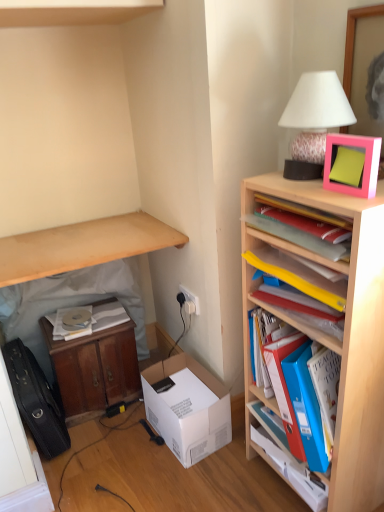
Question: Considering the relative positions of wooden bookshelf at right, acting as the second shelf starting from the bottom, and white paper at lower left, marked as the 2th book in a right-to-left arrangement, in the image provided, is wooden bookshelf at right, acting as the second shelf starting from the bottom, to the left of white paper at lower left, marked as the 2th book in a right-to-left arrangement, from the viewer's perspective?

Choices:
 (A) no
 (B) yes

Answer: (A)

Question: Is wooden bookshelf at right, placed as the 2th shelf when sorted from top to bottom, thinner than white paper at lower left, which ranks as the second book in front-to-back order?

Choices:
 (A) yes
 (B) no

Answer: (B)

Question: Is the depth of wooden bookshelf at right, placed as the 2th shelf when sorted from top to bottom, greater than that of white paper at lower left, marked as the 2th book in a right-to-left arrangement?

Choices:
 (A) yes
 (B) no

Answer: (B)

Question: Is wooden bookshelf at right, placed as the 2th shelf when sorted from top to bottom, positioned before white paper at lower left, the 1th book when ordered from left to right?

Choices:
 (A) no
 (B) yes

Answer: (B)

Question: Is wooden bookshelf at right, acting as the second shelf starting from the bottom, not within white paper at lower left, marked as the 2th book in a right-to-left arrangement?

Choices:
 (A) yes
 (B) no

Answer: (A)

Question: From a real-world perspective, is blue plastic folders at right, which appears as the 3th shelf when viewed from the top, above or below white paper at lower left, the 1th book when ordered from left to right?

Choices:
 (A) below
 (B) above

Answer: (B)

Question: From their relative heights in the image, would you say blue plastic folders at right, which ranks as the first shelf in bottom-to-top order, is taller or shorter than white paper at lower left, marked as the 2th book in a right-to-left arrangement?

Choices:
 (A) tall
 (B) short

Answer: (A)

Question: Considering the positions of point (314, 437) and point (51, 321), is point (314, 437) closer or farther from the camera than point (51, 321)?

Choices:
 (A) closer
 (B) farther

Answer: (A)

Question: Looking at their shapes, would you say blue plastic folders at right, which ranks as the first shelf in bottom-to-top order, is wider or thinner than white paper at lower left, which ranks as the second book in front-to-back order?

Choices:
 (A) wide
 (B) thin

Answer: (A)

Question: From the image's perspective, relative to pink matte picture frame at upper right, is white cardboard box at lower center above or below?

Choices:
 (A) above
 (B) below

Answer: (B)

Question: Visually, is white cardboard box at lower center positioned to the left or to the right of pink matte picture frame at upper right?

Choices:
 (A) left
 (B) right

Answer: (A)

Question: From their relative heights in the image, would you say white cardboard box at lower center is taller or shorter than pink matte picture frame at upper right?

Choices:
 (A) tall
 (B) short

Answer: (A)

Question: Would you say white cardboard box at lower center is inside or outside pink matte picture frame at upper right?

Choices:
 (A) outside
 (B) inside

Answer: (A)

Question: Does point (291, 272) appear closer or farther from the camera than point (67, 258)?

Choices:
 (A) closer
 (B) farther

Answer: (A)

Question: From the image's perspective, is yellow plastic folders at upper right, which appears as the 1th shelf when viewed from the top, above or below wooden cabinet at lower left, positioned as the second table in right-to-left order?

Choices:
 (A) below
 (B) above

Answer: (B)